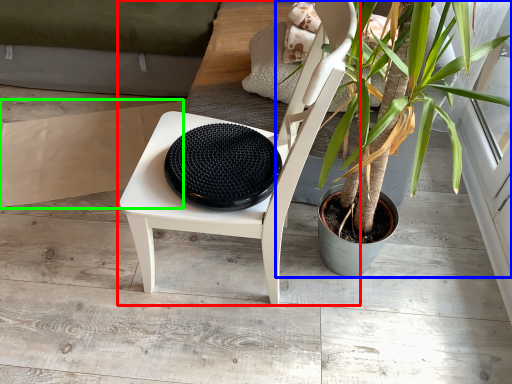
Question: Which object is positioned closest to chair (highlighted by a red box)? Select from houseplant (highlighted by a blue box) and cardboard (highlighted by a green box).

Choices:
 (A) houseplant
 (B) cardboard

Answer: (A)